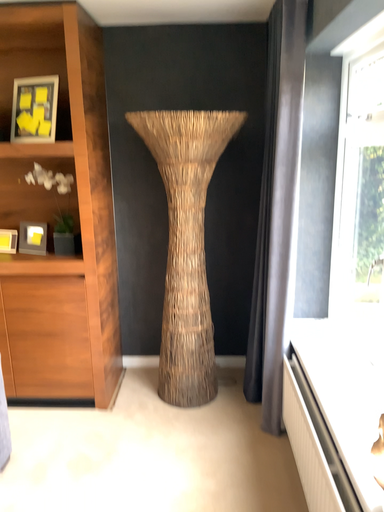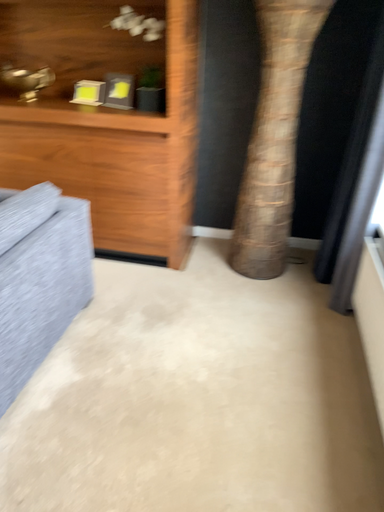
Question: How did the camera likely rotate when shooting the video?

Choices:
 (A) rotated left
 (B) rotated right

Answer: (A)